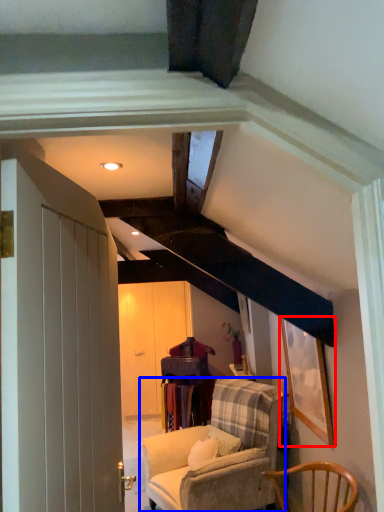
Question: Which point is further to the camera, picture frame (highlighted by a red box) or chair (highlighted by a blue box)?

Choices:
 (A) picture frame
 (B) chair

Answer: (B)